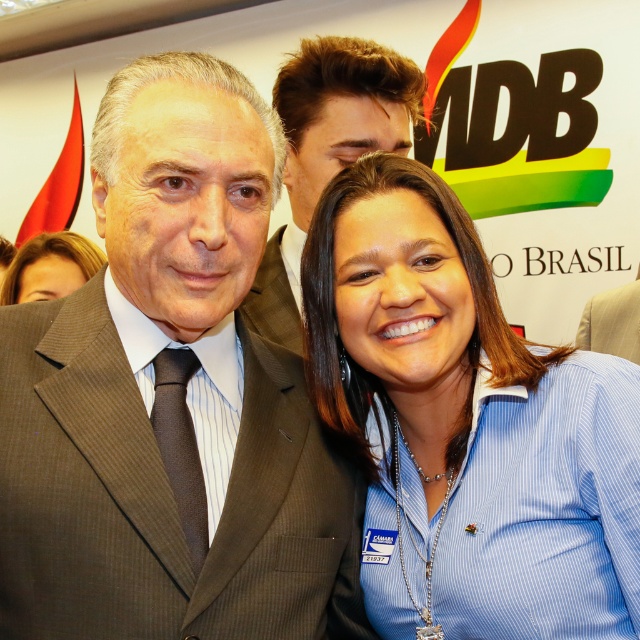
You are attending a formal event and need to determine which clothing item takes up more space in the photo. Based on the image, which is wider between the blue striped shirt at center and the light brown textured fabric business suit at center?

The blue striped shirt at center is wider than the light brown textured fabric business suit at center according to the description.

You are a photographer at the event and need to ensure both the brown pinstripe suit at center and the light brown textured fabric business suit at center are visible in the photo. Given their height difference, which suit will appear larger in the photo?

The brown pinstripe suit at center will appear larger in the photo because it is much taller than the light brown textured fabric business suit at center.